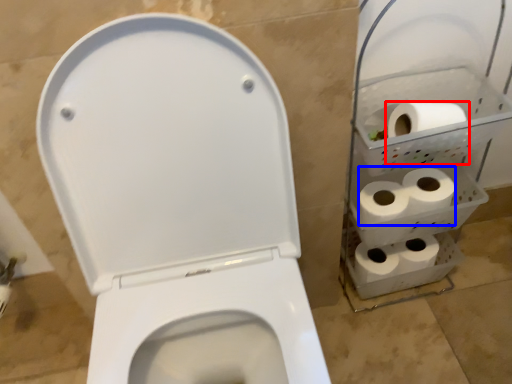
Question: Among these objects, which one is farthest to the camera, toilet paper (highlighted by a red box) or toilet paper (highlighted by a blue box)?

Choices:
 (A) toilet paper
 (B) toilet paper

Answer: (B)